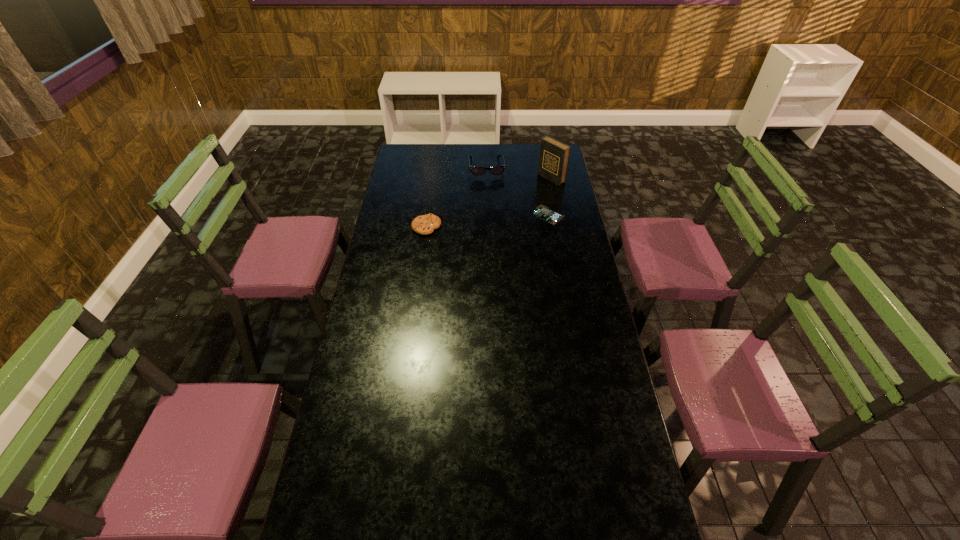
The width and height of the screenshot is (960, 540). I want to click on free space that is in between the tallest object and the second shortest object, so click(489, 202).

The image size is (960, 540). I want to click on free space that is in between the shortest object and the third tallest object, so click(488, 221).

Where is `vacant space that is in between the tallest object and the shortest object`? vacant space that is in between the tallest object and the shortest object is located at coordinates (550, 197).

At what (x,y) coordinates should I click in order to perform the action: click on free spot between the tallest object and the shortest object. Please return your answer as a coordinate pair (x, y). Image resolution: width=960 pixels, height=540 pixels. Looking at the image, I should click on (550, 197).

Locate an element on the screen. Image resolution: width=960 pixels, height=540 pixels. empty space between the second tallest object and the tallest object is located at coordinates (519, 173).

The width and height of the screenshot is (960, 540). What are the coordinates of `vacant area that lies between the third tallest object and the identity card` in the screenshot? It's located at (488, 221).

Locate which object is the second closest to the shortest object. Please provide its 2D coordinates. Your answer should be formatted as a tuple, i.e. [(x, y)], where the tuple contains the x and y coordinates of a point satisfying the conditions above.

[(496, 170)]

Locate an element on the screen. object that is the second closest to the cookie is located at coordinates (543, 212).

Where is `free space in the image that satisfies the following two spatial constraints: 1. on the back side of the diary; 2. on the left side of the identity card`? The width and height of the screenshot is (960, 540). free space in the image that satisfies the following two spatial constraints: 1. on the back side of the diary; 2. on the left side of the identity card is located at coordinates (542, 179).

Identify the location of free space that satisfies the following two spatial constraints: 1. on the back side of the second shortest object; 2. on the left side of the shortest object. (428, 215).